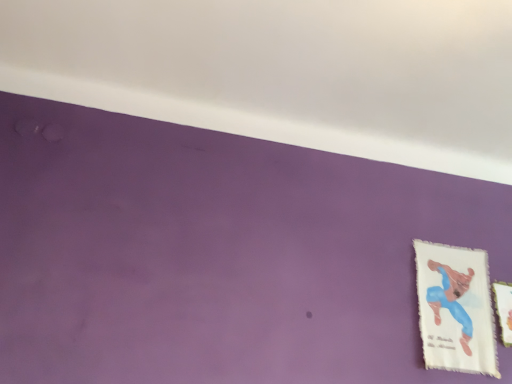
Question: Choose the correct answer: Is white fabric picture frame at right, the 1th picture frame when ordered from right to left, inside white fabric picture frame at lower right, acting as the first picture frame starting from the left, or outside it?

Choices:
 (A) outside
 (B) inside

Answer: (A)

Question: Based on their sizes in the image, would you say white fabric picture frame at right, the 1th picture frame when ordered from right to left, is bigger or smaller than white fabric picture frame at lower right, acting as the first picture frame starting from the left?

Choices:
 (A) big
 (B) small

Answer: (B)

Question: Is point (501, 311) positioned closer to the camera than point (438, 365)?

Choices:
 (A) farther
 (B) closer

Answer: (A)

Question: Looking at their shapes, would you say white fabric picture frame at lower right, acting as the first picture frame starting from the left, is wider or thinner than white fabric picture frame at right, placed as the second picture frame when sorted from left to right?

Choices:
 (A) wide
 (B) thin

Answer: (A)

Question: Considering the positions of point (445, 365) and point (509, 299), is point (445, 365) closer or farther from the camera than point (509, 299)?

Choices:
 (A) closer
 (B) farther

Answer: (A)

Question: From a real-world perspective, is white fabric picture frame at lower right, acting as the first picture frame starting from the left, positioned above or below white fabric picture frame at right, the 1th picture frame when ordered from right to left?

Choices:
 (A) above
 (B) below

Answer: (B)

Question: Relative to white fabric picture frame at right, placed as the second picture frame when sorted from left to right, is white fabric picture frame at lower right, acting as the first picture frame starting from the left, in front or behind?

Choices:
 (A) front
 (B) behind

Answer: (A)